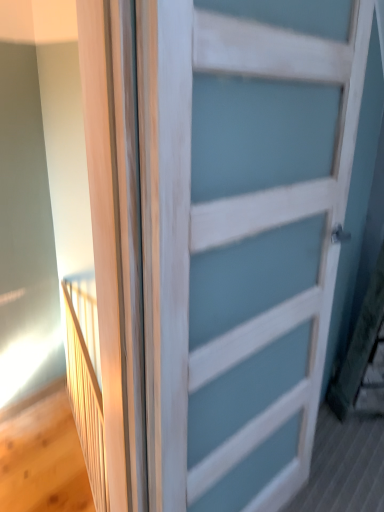
Question: From the image's perspective, is white matte door at center on top of wooden elevator at left?

Choices:
 (A) no
 (B) yes

Answer: (B)

Question: Is white matte door at center aimed at wooden elevator at left?

Choices:
 (A) no
 (B) yes

Answer: (A)

Question: Is white matte door at center taller than wooden elevator at left?

Choices:
 (A) no
 (B) yes

Answer: (B)

Question: From a real-world perspective, is white matte door at center on wooden elevator at left?

Choices:
 (A) yes
 (B) no

Answer: (A)

Question: Is the position of white matte door at center more distant than that of wooden elevator at left?

Choices:
 (A) yes
 (B) no

Answer: (B)

Question: Is white matte door at center not within wooden elevator at left?

Choices:
 (A) yes
 (B) no

Answer: (A)

Question: Is wooden elevator at left closer to the viewer compared to white matte door at center?

Choices:
 (A) yes
 (B) no

Answer: (B)

Question: Can you confirm if wooden elevator at left is wider than white matte door at center?

Choices:
 (A) no
 (B) yes

Answer: (A)

Question: Considering the relative sizes of wooden elevator at left and white matte door at center in the image provided, is wooden elevator at left shorter than white matte door at center?

Choices:
 (A) yes
 (B) no

Answer: (A)

Question: Considering the relative positions of wooden elevator at left and white matte door at center in the image provided, is wooden elevator at left behind white matte door at center?

Choices:
 (A) yes
 (B) no

Answer: (A)

Question: Is wooden elevator at left positioned beyond the bounds of white matte door at center?

Choices:
 (A) yes
 (B) no

Answer: (A)

Question: From a real-world perspective, does wooden elevator at left stand above white matte door at center?

Choices:
 (A) yes
 (B) no

Answer: (B)

Question: In terms of height, does white matte door at center look taller or shorter compared to wooden elevator at left?

Choices:
 (A) tall
 (B) short

Answer: (A)